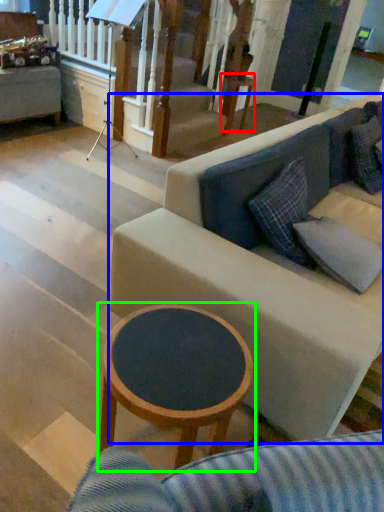
Question: Which object is the farthest from table (highlighted by a red box)? Choose among these: studio couch (highlighted by a blue box) or coffee table (highlighted by a green box).

Choices:
 (A) studio couch
 (B) coffee table

Answer: (B)